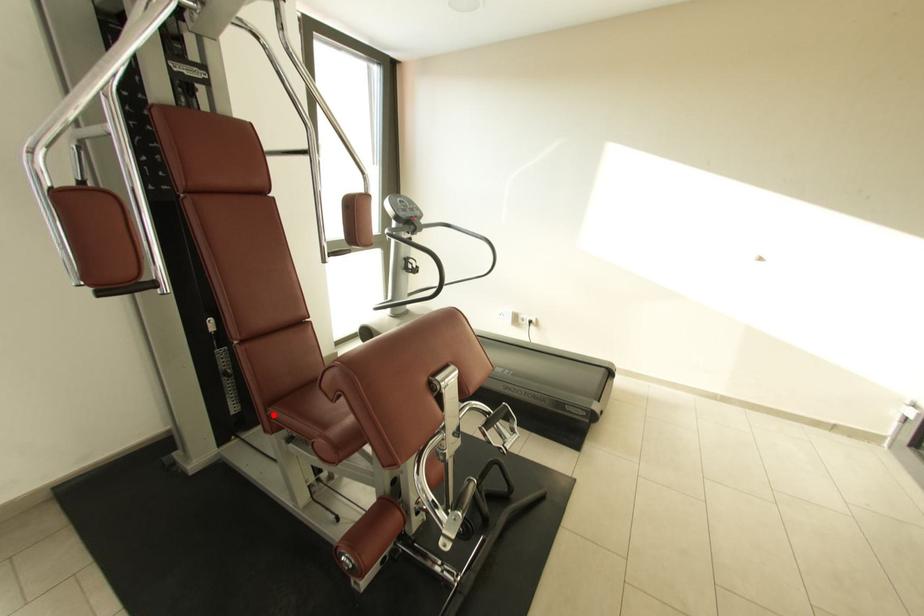
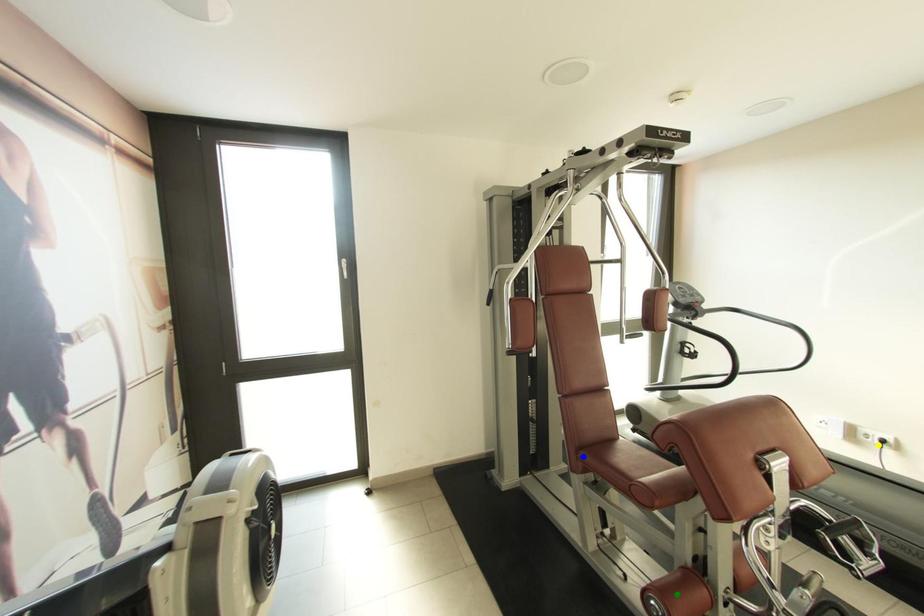
Question: I am providing you with two images of the same scene from different viewpoints. A red point is marked on the first image. You are given multiple points on the second image. In image 2, which mark is for the same physical point as the one in image 1?

Choices:
 (A) blue point
 (B) green point
 (C) yellow point

Answer: (A)